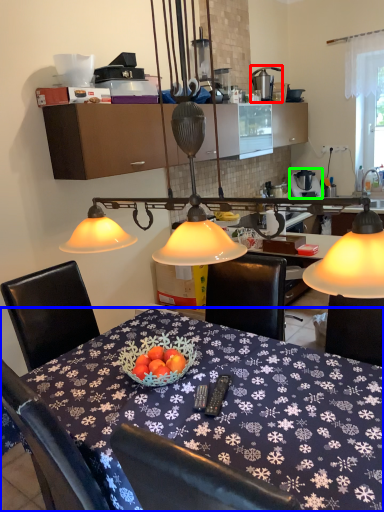
Question: Which object is positioned farthest from tableware (highlighted by a red box)? Select from desk (highlighted by a blue box) and appliance (highlighted by a green box).

Choices:
 (A) desk
 (B) appliance

Answer: (A)